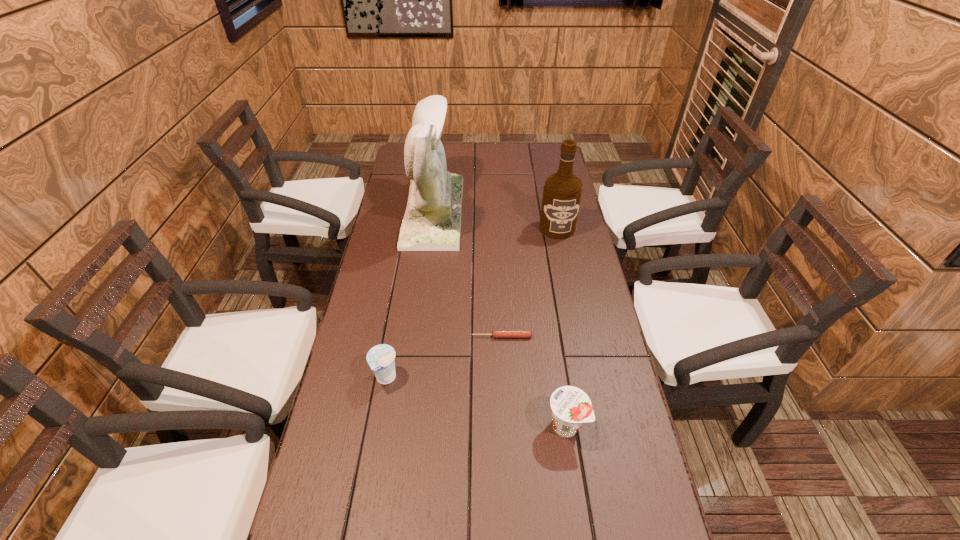
Locate an element on the screen. vacant space located 0.350m on the left of the nearer yogurt is located at coordinates (399, 426).

This screenshot has height=540, width=960. Identify the location of free space located on the right of the left yogurt. (549, 378).

Find the location of `vacant region located on the left of the third nearest object`. vacant region located on the left of the third nearest object is located at coordinates (366, 336).

The image size is (960, 540). What are the coordinates of `sculpture positioned at the left edge` in the screenshot? It's located at (432, 219).

Identify the location of yogurt that is at the left edge. (x=380, y=358).

I want to click on alcohol that is at the right edge, so click(562, 192).

This screenshot has width=960, height=540. In order to click on yogurt that is positioned at the right edge in this screenshot , I will do `click(571, 406)`.

Find the location of a particular element. The image size is (960, 540). vacant area at the far edge of the desktop is located at coordinates (520, 152).

What are the coordinates of `vacant area at the left edge of the desktop` in the screenshot? It's located at (407, 316).

This screenshot has width=960, height=540. Identify the location of vacant space at the right edge of the desktop. (578, 374).